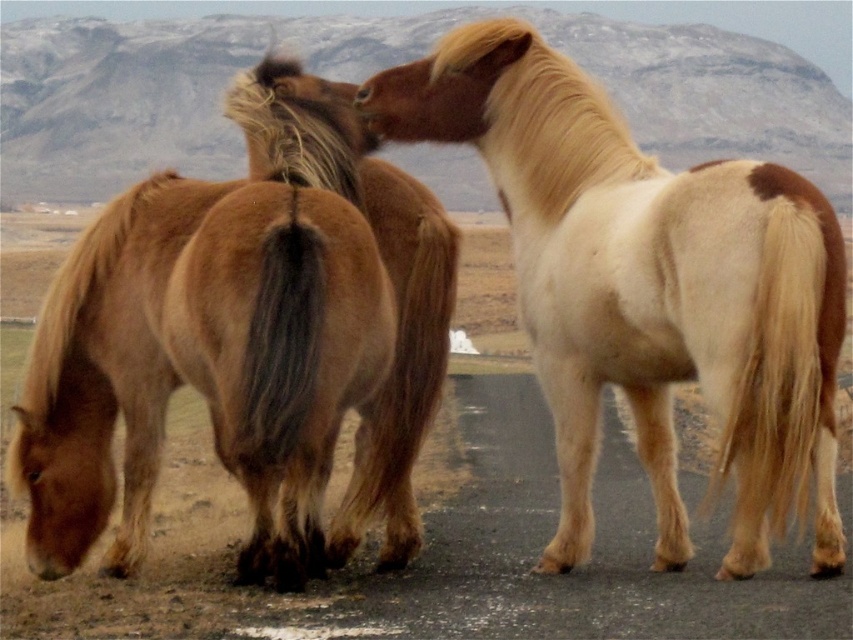
You are standing at the origin point of the image. Which direction should you move to reach the brown fuzzy horse at left?

The brown fuzzy horse at left is located at point 0.541 on the x axis and 0.247 on the y axis. Since you are at the origin point, you should move towards the right and slightly upwards to reach it.